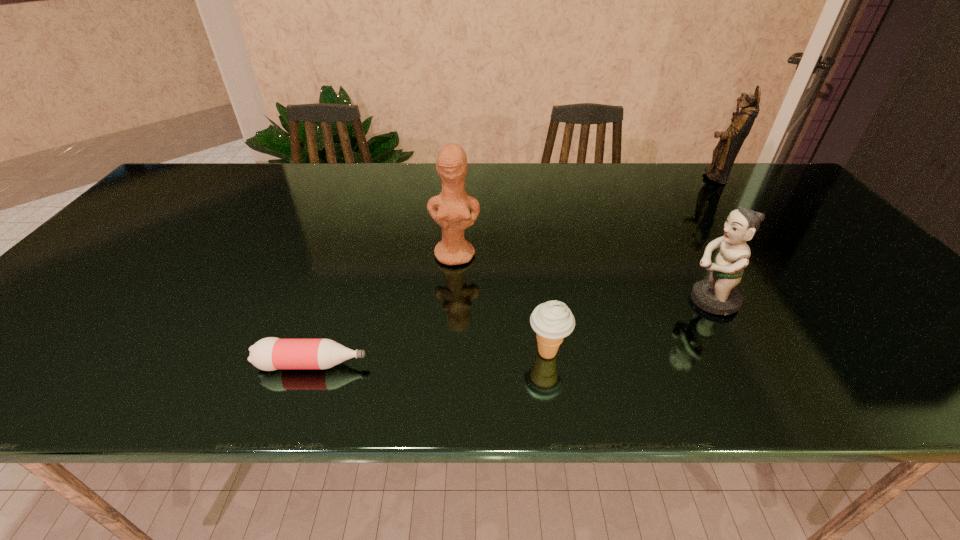
You are a GUI agent. You are given a task and a screenshot of the screen. Output one action in this format:
    pyautogui.click(x=<x>, y=<y>)
    Task: Click on the rightmost object
    The width and height of the screenshot is (960, 540).
    Given the screenshot: What is the action you would take?
    pyautogui.click(x=724, y=154)

Where is `the farthest object`? the farthest object is located at coordinates (724, 154).

Image resolution: width=960 pixels, height=540 pixels. In order to click on the second object from left to right in this screenshot , I will do `click(450, 209)`.

Find the location of `the leftmost figurine`. the leftmost figurine is located at coordinates (450, 209).

You are a GUI agent. You are given a task and a screenshot of the screen. Output one action in this format:
    pyautogui.click(x=<x>, y=<y>)
    Task: Click on the third shortest object
    Image resolution: width=960 pixels, height=540 pixels.
    Given the screenshot: What is the action you would take?
    pyautogui.click(x=717, y=295)

Image resolution: width=960 pixels, height=540 pixels. I want to click on the second object from right to left, so click(x=717, y=295).

At what (x,y) coordinates should I click in order to perform the action: click on the fourth tallest object. Please return your answer as a coordinate pair (x, y). This screenshot has height=540, width=960. Looking at the image, I should click on (552, 321).

The width and height of the screenshot is (960, 540). Find the location of `icecream`. icecream is located at coordinates (552, 321).

At what (x,y) coordinates should I click in order to perform the action: click on bottle. Please return your answer as a coordinate pair (x, y). This screenshot has height=540, width=960. Looking at the image, I should click on (271, 353).

I want to click on the leftmost object, so click(271, 353).